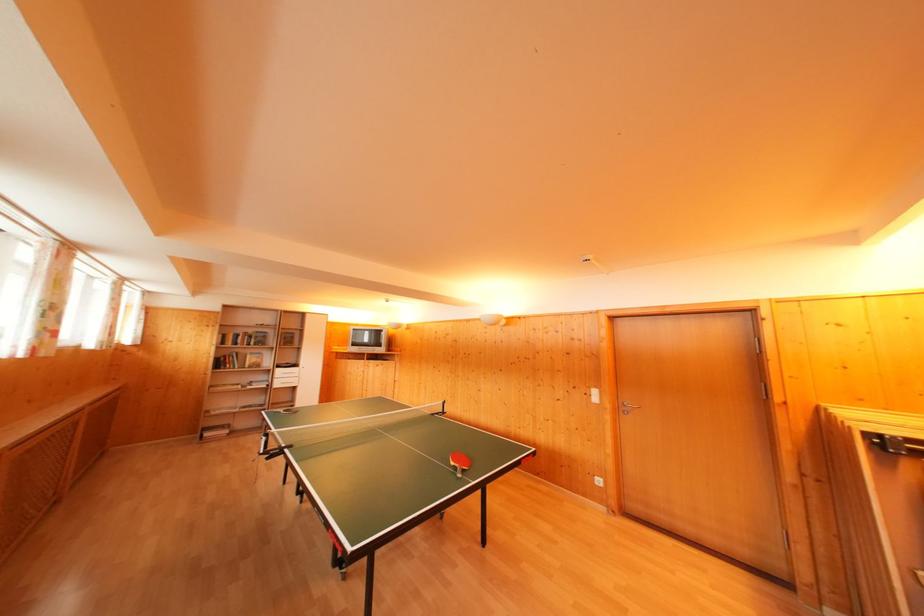
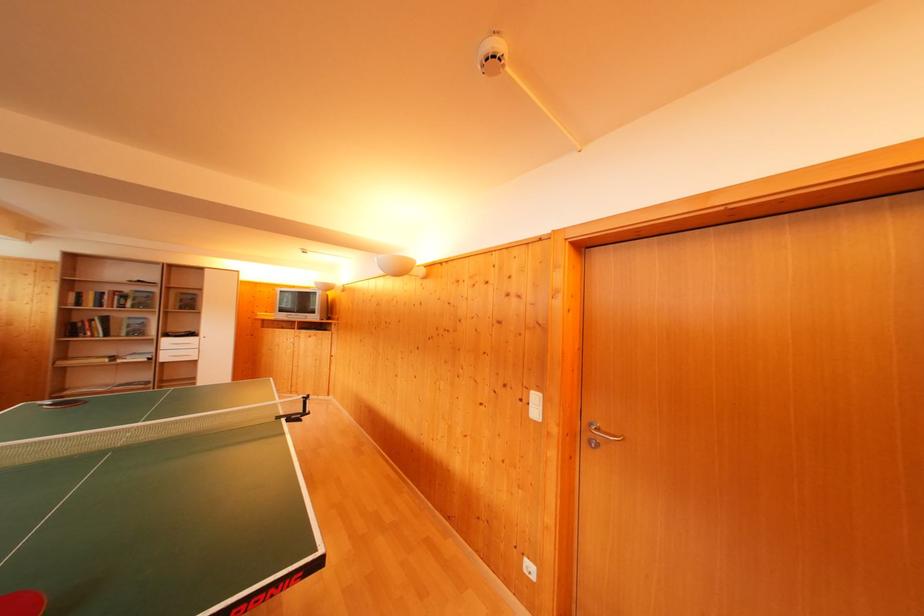
The point at (245,336) is marked in the first image. Where is the corresponding point in the second image?

(112, 294)